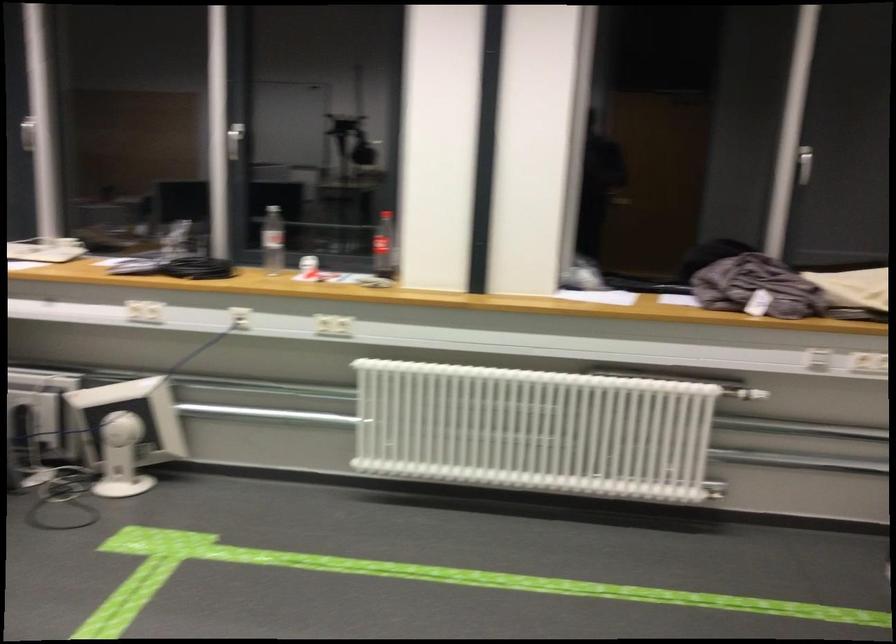
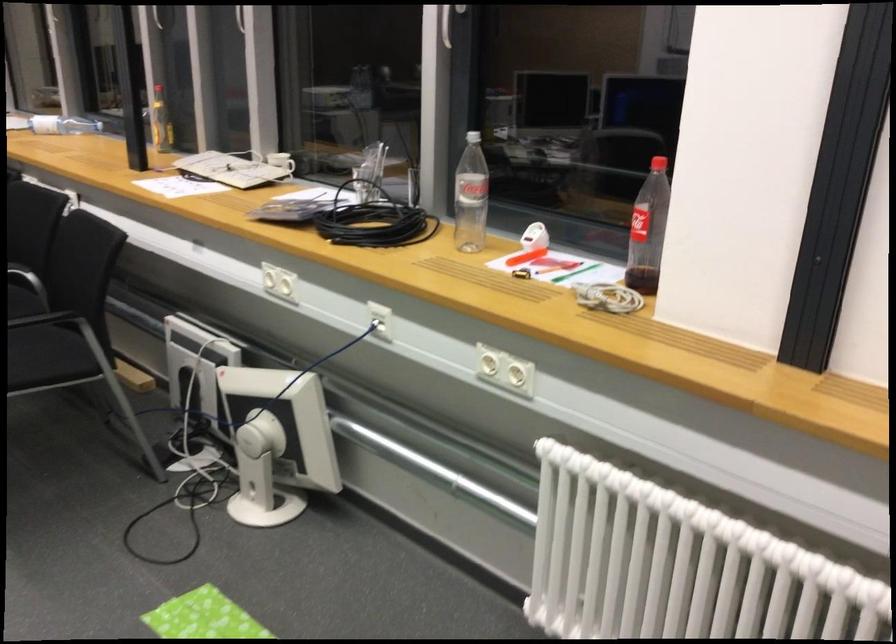
In the second image, find the point that corresponds to point 280,247 in the first image.

(470, 196)